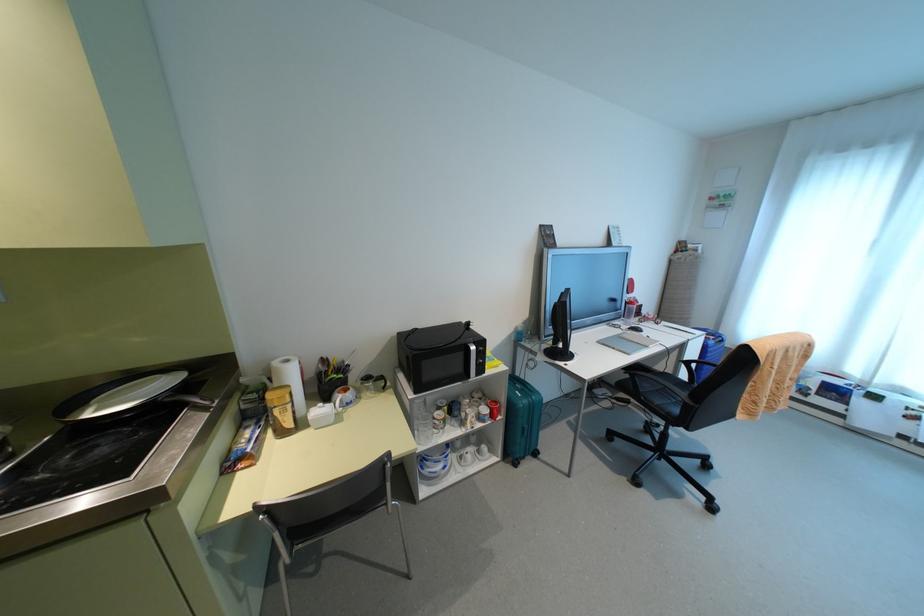
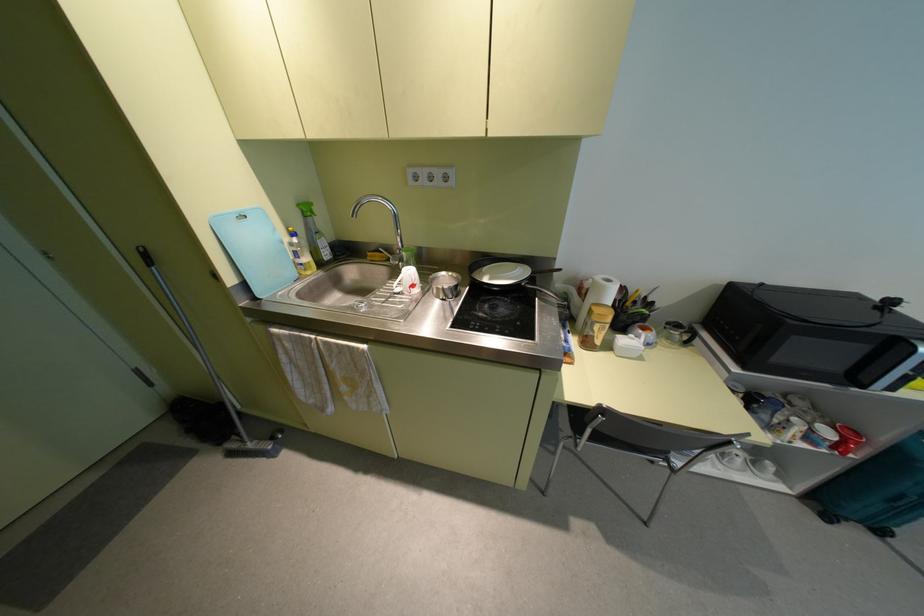
In the second image, find the point that corresponds to (x=288, y=424) in the first image.

(598, 341)